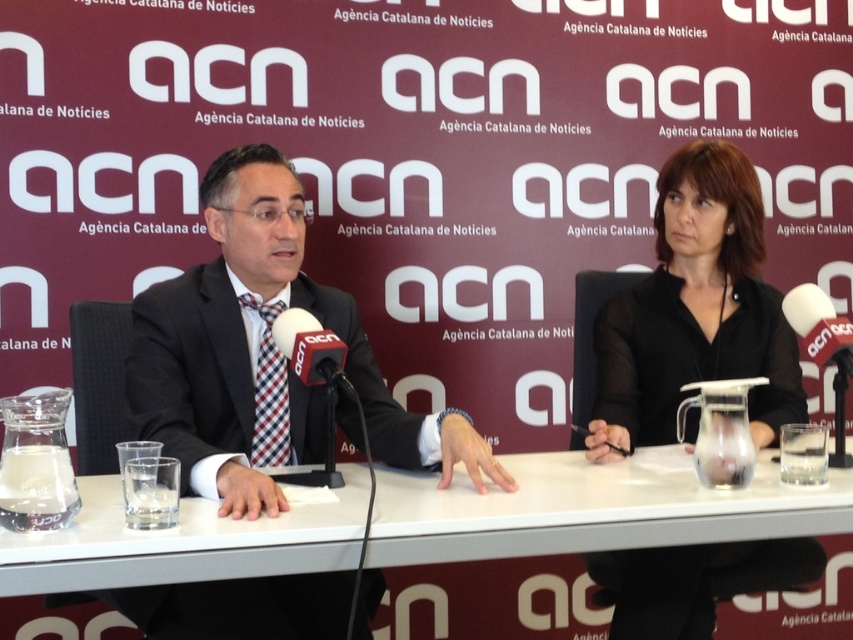
Question: Does matte black suit at center have a larger size compared to white glossy table at center?

Choices:
 (A) yes
 (B) no

Answer: (A)

Question: Which point is closer to the camera?

Choices:
 (A) (662, 433)
 (B) (198, 595)
 (C) (254, 557)

Answer: (C)

Question: Observing the image, what is the correct spatial positioning of matte black suit at center in reference to white glossy table at center?

Choices:
 (A) right
 (B) left

Answer: (B)

Question: Can you confirm if black matte shirt at center is smaller than white matte microphone at center?

Choices:
 (A) no
 (B) yes

Answer: (A)

Question: Which object appears closest to the camera in this image?

Choices:
 (A) matte black suit at center
 (B) dark gray suit at center
 (C) white matte microphone at center
 (D) white glossy table at center

Answer: (D)

Question: Which point appears farthest from the camera in this image?

Choices:
 (A) (245, 480)
 (B) (485, 541)
 (C) (753, 193)
 (D) (828, 300)

Answer: (C)